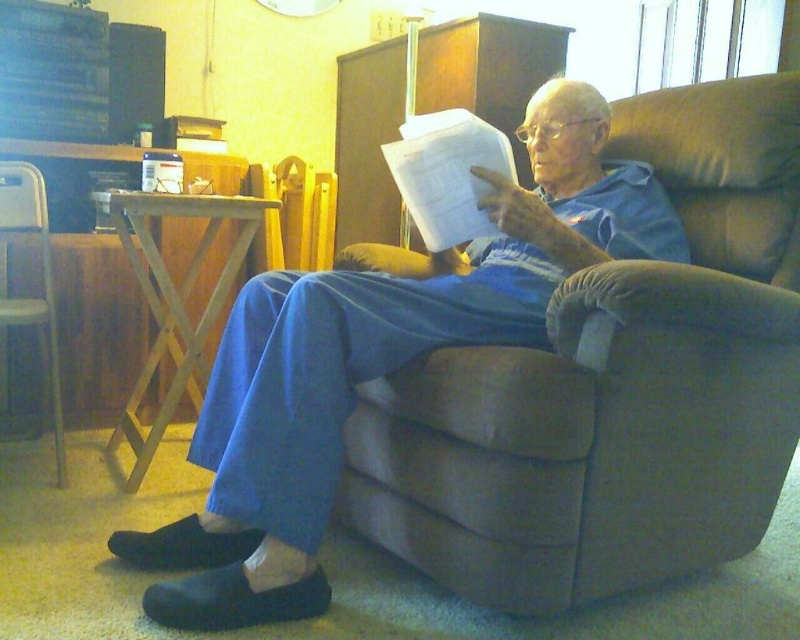
Question: Estimate the real-world distances between objects in this image. Which object is closer to the metallic silver chair at left?

Choices:
 (A) blue cotton pants at center
 (B) white paper at center

Answer: (A)

Question: Among these points, which one is farthest from the camera?

Choices:
 (A) (642, 240)
 (B) (34, 216)

Answer: (B)

Question: Does white paper at center have a greater width compared to metallic silver chair at left?

Choices:
 (A) no
 (B) yes

Answer: (A)

Question: Considering the relative positions of blue cotton pants at center and metallic silver chair at left in the image provided, where is blue cotton pants at center located with respect to metallic silver chair at left?

Choices:
 (A) above
 (B) below

Answer: (B)

Question: Among these objects, which one is farthest from the camera?

Choices:
 (A) metallic silver chair at left
 (B) white paper at center

Answer: (A)

Question: Does white paper at center have a greater width compared to metallic silver chair at left?

Choices:
 (A) yes
 (B) no

Answer: (B)